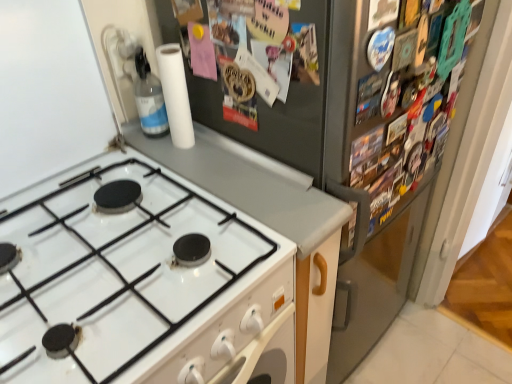
Question: Are transparent plastic bottle at upper left and satin silver fridge at upper right located far from each other?

Choices:
 (A) no
 (B) yes

Answer: (A)

Question: Considering the relative sizes of transparent plastic bottle at upper left and satin silver fridge at upper right in the image provided, is transparent plastic bottle at upper left taller than satin silver fridge at upper right?

Choices:
 (A) no
 (B) yes

Answer: (A)

Question: From the image's perspective, is transparent plastic bottle at upper left over satin silver fridge at upper right?

Choices:
 (A) no
 (B) yes

Answer: (B)

Question: Is transparent plastic bottle at upper left positioned behind satin silver fridge at upper right?

Choices:
 (A) no
 (B) yes

Answer: (B)

Question: Is satin silver fridge at upper right a part of transparent plastic bottle at upper left?

Choices:
 (A) yes
 (B) no

Answer: (B)

Question: Based on their sizes in the image, would you say white matte countertop at center is bigger or smaller than white matte paper towel at upper center?

Choices:
 (A) big
 (B) small

Answer: (A)

Question: From a real-world perspective, is white matte countertop at center positioned above or below white matte paper towel at upper center?

Choices:
 (A) above
 (B) below

Answer: (B)

Question: Considering the positions of white matte countertop at center and white matte paper towel at upper center in the image, is white matte countertop at center wider or thinner than white matte paper towel at upper center?

Choices:
 (A) thin
 (B) wide

Answer: (B)

Question: From the image's perspective, is white matte countertop at center positioned above or below white matte paper towel at upper center?

Choices:
 (A) above
 (B) below

Answer: (B)

Question: Is transparent plastic bottle at upper left wider or thinner than satin silver fridge at upper right?

Choices:
 (A) wide
 (B) thin

Answer: (B)

Question: From a real-world perspective, is transparent plastic bottle at upper left positioned above or below satin silver fridge at upper right?

Choices:
 (A) above
 (B) below

Answer: (A)

Question: Is transparent plastic bottle at upper left situated inside satin silver fridge at upper right or outside?

Choices:
 (A) outside
 (B) inside

Answer: (A)

Question: Considering the relative positions of transparent plastic bottle at upper left and satin silver fridge at upper right in the image provided, is transparent plastic bottle at upper left to the left or to the right of satin silver fridge at upper right?

Choices:
 (A) left
 (B) right

Answer: (A)

Question: Does point (374, 96) appear closer or farther from the camera than point (110, 215)?

Choices:
 (A) farther
 (B) closer

Answer: (B)

Question: Considering the positions of satin silver fridge at upper right and white glossy gas stove at lower left in the image, is satin silver fridge at upper right taller or shorter than white glossy gas stove at lower left?

Choices:
 (A) tall
 (B) short

Answer: (A)